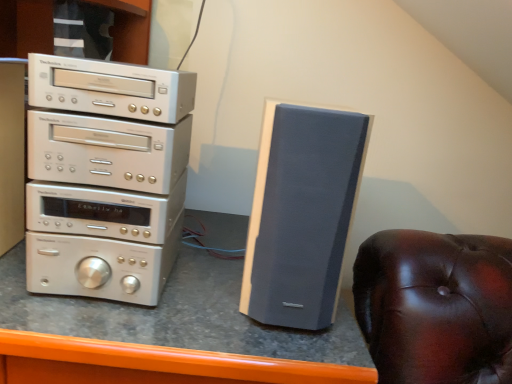
Question: Is matte gray speaker at right facing towards silver metallic stereo stack at left?

Choices:
 (A) yes
 (B) no

Answer: (B)

Question: Is matte gray speaker at right positioned with its back to silver metallic stereo stack at left?

Choices:
 (A) no
 (B) yes

Answer: (A)

Question: Considering the relative sizes of matte gray speaker at right and silver metallic stereo stack at left in the image provided, is matte gray speaker at right bigger than silver metallic stereo stack at left?

Choices:
 (A) no
 (B) yes

Answer: (A)

Question: From the image's perspective, is matte gray speaker at right under silver metallic stereo stack at left?

Choices:
 (A) no
 (B) yes

Answer: (B)

Question: Considering the relative sizes of matte gray speaker at right and silver metallic stereo stack at left in the image provided, is matte gray speaker at right thinner than silver metallic stereo stack at left?

Choices:
 (A) yes
 (B) no

Answer: (B)

Question: From a real-world perspective, is matte gray speaker at right physically located above or below silver metallic stereo stack at left?

Choices:
 (A) below
 (B) above

Answer: (A)

Question: In the image, is matte gray speaker at right positioned in front of or behind silver metallic stereo stack at left?

Choices:
 (A) front
 (B) behind

Answer: (A)

Question: Considering the positions of matte gray speaker at right and silver metallic stereo stack at left in the image, is matte gray speaker at right bigger or smaller than silver metallic stereo stack at left?

Choices:
 (A) big
 (B) small

Answer: (B)

Question: From their relative heights in the image, would you say matte gray speaker at right is taller or shorter than silver metallic stereo stack at left?

Choices:
 (A) short
 (B) tall

Answer: (A)

Question: In the image, is matte gray speaker at right on the left side or the right side of matte gray speaker at center?

Choices:
 (A) right
 (B) left

Answer: (A)

Question: From the image's perspective, is matte gray speaker at right positioned above or below matte gray speaker at center?

Choices:
 (A) above
 (B) below

Answer: (A)

Question: Looking at their shapes, would you say matte gray speaker at right is wider or thinner than matte gray speaker at center?

Choices:
 (A) wide
 (B) thin

Answer: (B)

Question: Relative to matte gray speaker at center, is matte gray speaker at right in front or behind?

Choices:
 (A) behind
 (B) front

Answer: (A)

Question: Considering the positions of silver metallic stereo stack at left and matte gray speaker at right in the image, is silver metallic stereo stack at left wider or thinner than matte gray speaker at right?

Choices:
 (A) wide
 (B) thin

Answer: (B)

Question: In terms of size, does silver metallic stereo stack at left appear bigger or smaller than matte gray speaker at right?

Choices:
 (A) small
 (B) big

Answer: (B)